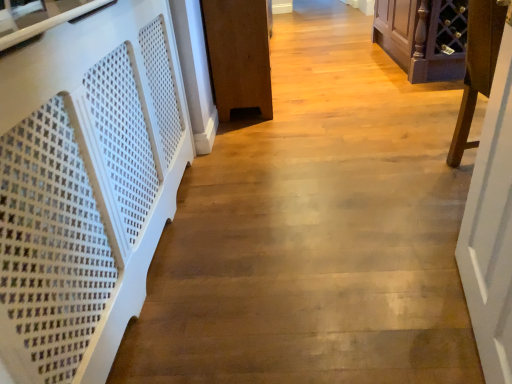
What is the approximate height of dark wood wine rack at upper right, the 1th furniture in the right-to-left sequence?

dark wood wine rack at upper right, the 1th furniture in the right-to-left sequence, is 22.57 inches in height.

Measure the distance between point (259, 268) and camera.

Point (259, 268) is 1.49 meters away from camera.

Where is `white perforated wood at left`? white perforated wood at left is located at coordinates (85, 185).

The width and height of the screenshot is (512, 384). What do you see at coordinates (477, 67) in the screenshot? I see `purple wood wine rack at right, which appears as the 2th furniture when viewed from the left` at bounding box center [477, 67].

Identify the location of brown wood cabinet at center, the 3th furniture viewed from the right. The height and width of the screenshot is (384, 512). (238, 55).

This screenshot has height=384, width=512. What do you see at coordinates (238, 55) in the screenshot?
I see `brown wood cabinet at center, the 3th furniture viewed from the right` at bounding box center [238, 55].

Find the location of a particular element. dark wood wine rack at upper right, the third furniture positioned from the left is located at coordinates (423, 37).

Between purple wood wine rack at right, which appears as the 2th furniture when viewed from the left, and dark wood wine rack at upper right, the third furniture positioned from the left, which one has larger width?

With larger width is dark wood wine rack at upper right, the third furniture positioned from the left.

Looking at this image, which is correct: purple wood wine rack at right, marked as the 2th furniture in a right-to-left arrangement, is inside dark wood wine rack at upper right, the 1th furniture in the right-to-left sequence, or outside of it?

purple wood wine rack at right, marked as the 2th furniture in a right-to-left arrangement, is not enclosed by dark wood wine rack at upper right, the 1th furniture in the right-to-left sequence.

Which point is more forward, (x=475, y=56) or (x=462, y=39)?

The point (x=475, y=56) is closer.

Starting from the purple wood wine rack at right, marked as the 2th furniture in a right-to-left arrangement, which furniture is the 2nd one behind? Please provide its 2D coordinates.

[(423, 37)]

Would you say white perforated wood at left is part of white perforated panel at left's contents?

No, white perforated wood at left is not surrounded by white perforated panel at left.

Are white perforated panel at left and white perforated wood at left located far from each other?

No, white perforated panel at left is not far away from white perforated wood at left.

You are a GUI agent. You are given a task and a screenshot of the screen. Output one action in this format:
    pyautogui.click(x=<x>, y=<y>)
    Task: Click on the path below the white perforated wood at left (from a real-world perspective)
    The width and height of the screenshot is (512, 384).
    Given the screenshot: What is the action you would take?
    pyautogui.click(x=315, y=230)

Considering the sizes of objects purple wood wine rack at right, which appears as the 2th furniture when viewed from the left, and brown wood cabinet at center, which is the 1th furniture from left to right, in the image provided, who is taller, purple wood wine rack at right, which appears as the 2th furniture when viewed from the left, or brown wood cabinet at center, which is the 1th furniture from left to right,?

Standing taller between the two is purple wood wine rack at right, which appears as the 2th furniture when viewed from the left.

Is purple wood wine rack at right, which appears as the 2th furniture when viewed from the left, spatially inside brown wood cabinet at center, the 3th furniture viewed from the right, or outside of it?

purple wood wine rack at right, which appears as the 2th furniture when viewed from the left, is located beyond the bounds of brown wood cabinet at center, the 3th furniture viewed from the right.

Is purple wood wine rack at right, which appears as the 2th furniture when viewed from the left, positioned far away from brown wood cabinet at center, the 3th furniture viewed from the right?

purple wood wine rack at right, which appears as the 2th furniture when viewed from the left, is positioned a significant distance from brown wood cabinet at center, the 3th furniture viewed from the right.

Looking at this image, measure the distance between purple wood wine rack at right, marked as the 2th furniture in a right-to-left arrangement, and brown wood cabinet at center, which is the 1th furniture from left to right.

purple wood wine rack at right, marked as the 2th furniture in a right-to-left arrangement, is 1.24 meters away from brown wood cabinet at center, which is the 1th furniture from left to right.

Is brown wood cabinet at center, the 3th furniture viewed from the right, thinner than white wooden door at right?

No.

Is point (263, 30) positioned after point (507, 278)?

Yes.

Is brown wood cabinet at center, which is the 1th furniture from left to right, oriented away from white wooden door at right?

No, brown wood cabinet at center, which is the 1th furniture from left to right, is not facing away from white wooden door at right.

This screenshot has width=512, height=384. There is a white wooden door at right. In order to click on the 2nd furniture below it (from a real-world perspective) in this screenshot , I will do `click(238, 55)`.

In the scene shown: From the image's perspective, does dark wood wine rack at upper right, the third furniture positioned from the left, appear lower than white perforated wood at left?

No, from the image's perspective, dark wood wine rack at upper right, the third furniture positioned from the left, is not below white perforated wood at left.

Between dark wood wine rack at upper right, the 1th furniture in the right-to-left sequence, and white perforated wood at left, which one has smaller size?

white perforated wood at left is smaller.

Is point (457, 59) in front of point (174, 99)?

No, (457, 59) is behind (174, 99).

Can you tell me how much dark wood wine rack at upper right, the 1th furniture in the right-to-left sequence, and white perforated wood at left differ in facing direction?

They differ by 90.6 degrees in their facing directions.

Is dark wood wine rack at upper right, the 1th furniture in the right-to-left sequence, looking in the opposite direction of white wooden door at right?

Yes, dark wood wine rack at upper right, the 1th furniture in the right-to-left sequence, is facing away from white wooden door at right.

From a real-world perspective, is dark wood wine rack at upper right, the 1th furniture in the right-to-left sequence, physically located above or below white wooden door at right?

Clearly, from a real-world perspective, dark wood wine rack at upper right, the 1th furniture in the right-to-left sequence, is below white wooden door at right.

From the image's perspective, between dark wood wine rack at upper right, the 1th furniture in the right-to-left sequence, and white wooden door at right, who is located below?

white wooden door at right, from the image's perspective.

Is dark wood wine rack at upper right, the 1th furniture in the right-to-left sequence, behind white wooden door at right?

Yes, it is behind white wooden door at right.

From the image's perspective, is white perforated panel at left above or below dark wood wine rack at upper right, the 1th furniture in the right-to-left sequence?

white perforated panel at left is situated lower than dark wood wine rack at upper right, the 1th furniture in the right-to-left sequence, in the image.

Is white perforated panel at left beside dark wood wine rack at upper right, the 1th furniture in the right-to-left sequence?

white perforated panel at left and dark wood wine rack at upper right, the 1th furniture in the right-to-left sequence, are not in contact.

Is white perforated panel at left at the right side of dark wood wine rack at upper right, the 1th furniture in the right-to-left sequence?

No.

Is white perforated panel at left positioned beyond the bounds of dark wood wine rack at upper right, the third furniture positioned from the left?

That's correct, white perforated panel at left is outside of dark wood wine rack at upper right, the third furniture positioned from the left.

The width and height of the screenshot is (512, 384). There is a purple wood wine rack at right, which appears as the 2th furniture when viewed from the left. What are the coordinates of `the 2nd furniture below it (from a real-world perspective)` in the screenshot? It's located at (x=423, y=37).

This screenshot has height=384, width=512. In order to click on stairwell on the left side of white perforated panel at left in this screenshot , I will do `click(85, 185)`.

When comparing their distances from white perforated wood at left, does purple wood wine rack at right, marked as the 2th furniture in a right-to-left arrangement, or brown wood cabinet at center, which is the 1th furniture from left to right, seem closer?

The object closer to white perforated wood at left is purple wood wine rack at right, marked as the 2th furniture in a right-to-left arrangement.

Which object lies nearer to the anchor point brown wood cabinet at center, the 3th furniture viewed from the right, purple wood wine rack at right, marked as the 2th furniture in a right-to-left arrangement, or white wooden door at right?

purple wood wine rack at right, marked as the 2th furniture in a right-to-left arrangement, is closer to brown wood cabinet at center, the 3th furniture viewed from the right.

Estimate the real-world distances between objects in this image. Which object is further from brown wood cabinet at center, which is the 1th furniture from left to right, dark wood wine rack at upper right, the 1th furniture in the right-to-left sequence, or white perforated wood at left?

dark wood wine rack at upper right, the 1th furniture in the right-to-left sequence, is positioned further to the anchor brown wood cabinet at center, which is the 1th furniture from left to right.

Estimate the real-world distances between objects in this image. Which object is closer to dark wood wine rack at upper right, the 1th furniture in the right-to-left sequence, purple wood wine rack at right, which appears as the 2th furniture when viewed from the left, or white perforated wood at left?

Among the two, purple wood wine rack at right, which appears as the 2th furniture when viewed from the left, is located nearer to dark wood wine rack at upper right, the 1th furniture in the right-to-left sequence.

Estimate the real-world distances between objects in this image. Which object is further from white perforated wood at left, dark wood wine rack at upper right, the third furniture positioned from the left, or white perforated panel at left?

dark wood wine rack at upper right, the third furniture positioned from the left, is positioned further to the anchor white perforated wood at left.

Based on their spatial positions, is brown wood cabinet at center, which is the 1th furniture from left to right, or dark wood wine rack at upper right, the third furniture positioned from the left, closer to white perforated panel at left?

brown wood cabinet at center, which is the 1th furniture from left to right, is closer to white perforated panel at left.

Which object lies further to the anchor point dark wood wine rack at upper right, the third furniture positioned from the left, brown wood cabinet at center, which is the 1th furniture from left to right, or purple wood wine rack at right, which appears as the 2th furniture when viewed from the left?

purple wood wine rack at right, which appears as the 2th furniture when viewed from the left.

When comparing their distances from purple wood wine rack at right, marked as the 2th furniture in a right-to-left arrangement, does white perforated wood at left or brown wood cabinet at center, which is the 1th furniture from left to right, seem further?

brown wood cabinet at center, which is the 1th furniture from left to right, is positioned further to the anchor purple wood wine rack at right, marked as the 2th furniture in a right-to-left arrangement.

Where is `furniture positioned between white perforated panel at left and brown wood cabinet at center, which is the 1th furniture from left to right, from near to far`? The image size is (512, 384). furniture positioned between white perforated panel at left and brown wood cabinet at center, which is the 1th furniture from left to right, from near to far is located at coordinates (477, 67).

The image size is (512, 384). Identify the location of door between white perforated wood at left and dark wood wine rack at upper right, the third furniture positioned from the left, along the z-axis. (488, 187).

Identify the location of path between white wooden door at right and dark wood wine rack at upper right, the third furniture positioned from the left, in the front-back direction. The width and height of the screenshot is (512, 384). (315, 230).

Locate an element on the screen. The height and width of the screenshot is (384, 512). path located between white perforated wood at left and dark wood wine rack at upper right, the third furniture positioned from the left, in the depth direction is located at coordinates (315, 230).